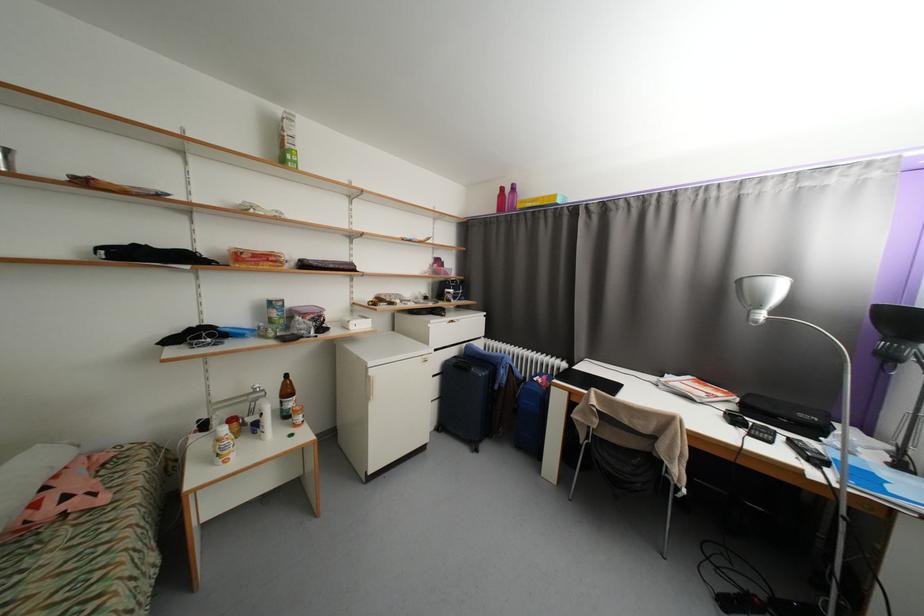
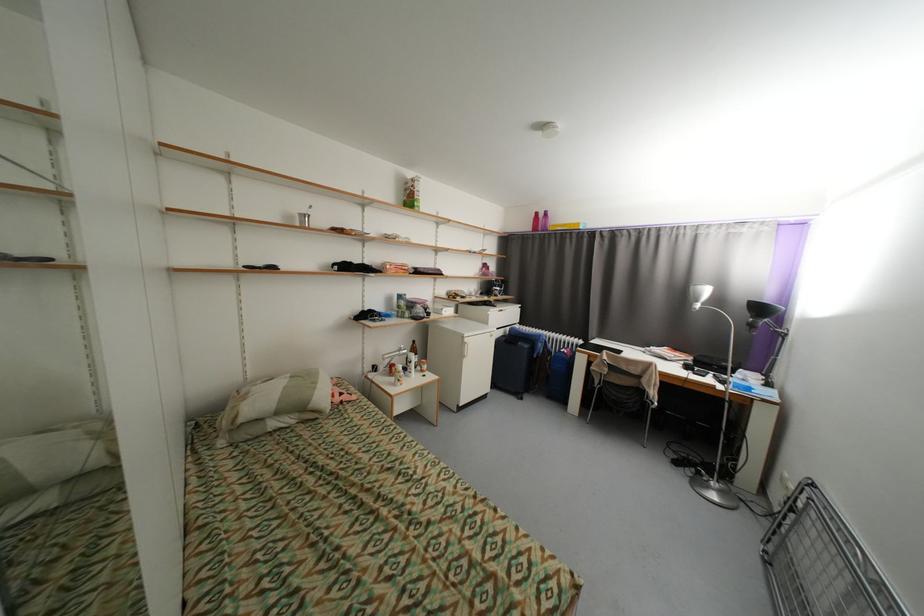
In a continuous first-person perspective shot, in which direction is the camera moving?

The cameraman walked toward left, backward.